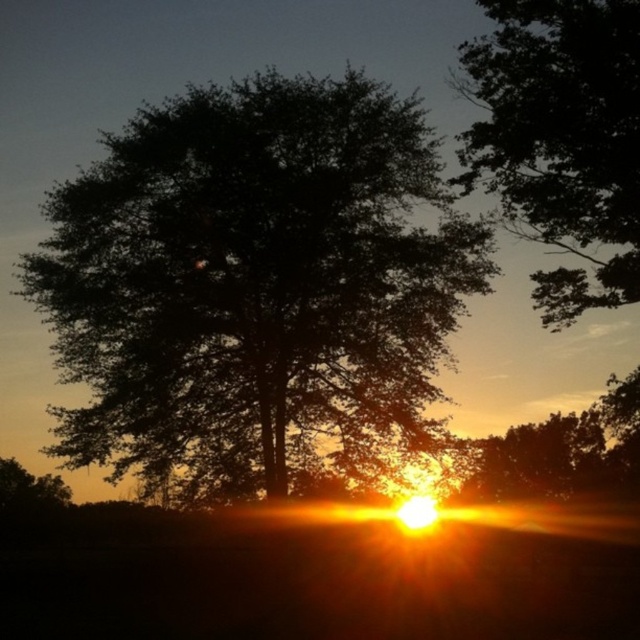
Is the position of dark green leafy tree at center less distant than that of dark green leafy tree at upper center?

No, it is not.

Does point (232, 134) lie behind point (628, 212)?

That is True.

In order to click on dark green leafy tree at center in this screenshot , I will do `click(252, 275)`.